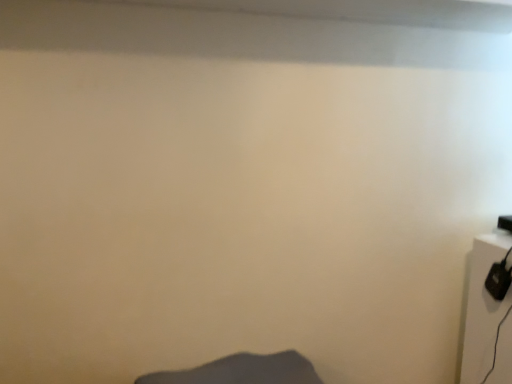
Locate an element on the screen. Image resolution: width=512 pixels, height=384 pixels. dark gray fabric at lower center is located at coordinates (242, 371).

What do you see at coordinates (242, 371) in the screenshot? I see `dark gray fabric at lower center` at bounding box center [242, 371].

I want to click on dark gray fabric at lower center, so click(242, 371).